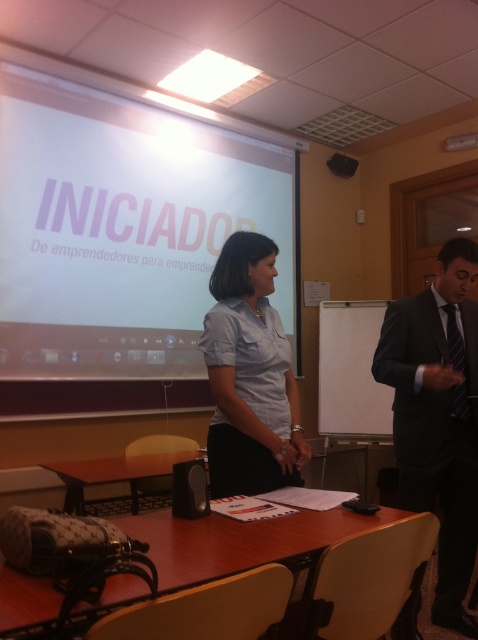
Question: Is white matte projection screen at upper center to the left of light blue shirt at center from the viewer's perspective?

Choices:
 (A) no
 (B) yes

Answer: (B)

Question: Among these objects, which one is farthest from the camera?

Choices:
 (A) striped silk tie at right
 (B) black suit at right

Answer: (A)

Question: Considering the relative positions of light blue shirt at center and brown wooden table at lower center in the image provided, where is light blue shirt at center located with respect to brown wooden table at lower center?

Choices:
 (A) right
 (B) left

Answer: (A)

Question: Which point appears closest to the camera in this image?

Choices:
 (A) (76, 497)
 (B) (315, 547)

Answer: (B)

Question: Among these objects, which one is farthest from the camera?

Choices:
 (A) white matte projection screen at upper center
 (B) brown wooden table at lower center
 (C) black suit at right

Answer: (A)

Question: Observing the image, what is the correct spatial positioning of brown wood table at lower center in reference to brown wooden table at lower center?

Choices:
 (A) below
 (B) above

Answer: (B)